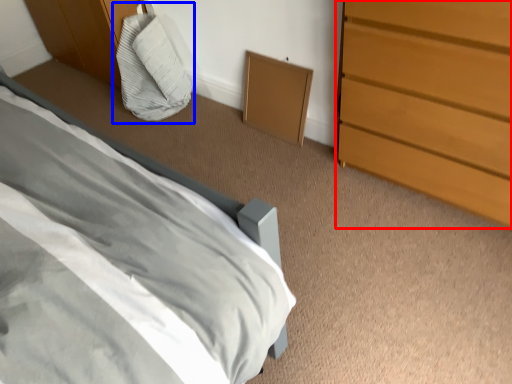
Question: Which object is closer to the camera taking this photo, chest of drawers (highlighted by a red box) or bean bag chair (highlighted by a blue box)?

Choices:
 (A) chest of drawers
 (B) bean bag chair

Answer: (A)